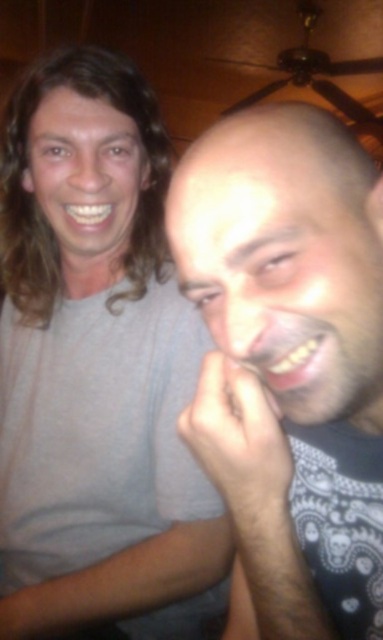
You are standing in the room and want to place a small decoration between the two points, point (124, 422) and point (291, 182). Which point is closer to you so you can start placing the decoration from there?

Point (124, 422) is further to the camera than point (291, 182), so point (291, 182) is closer to you. Start placing the decoration from point (291, 182).

Two people are sitting in a room with wooden walls. There is a point at coordinates point (152, 628). How far apart are the two people?

The two people are 33.56 inches apart.

You are a fashion designer observing two people in the scene. You need to determine which of the two shirts, the gray matte shirt at upper left or the dark gray shirt at right, would require more fabric to make a similar sized version. Based on their height in the image, which one would need more fabric?

The gray matte shirt at upper left is taller than dark gray shirt at right, so it would require more fabric to make a similar sized version.